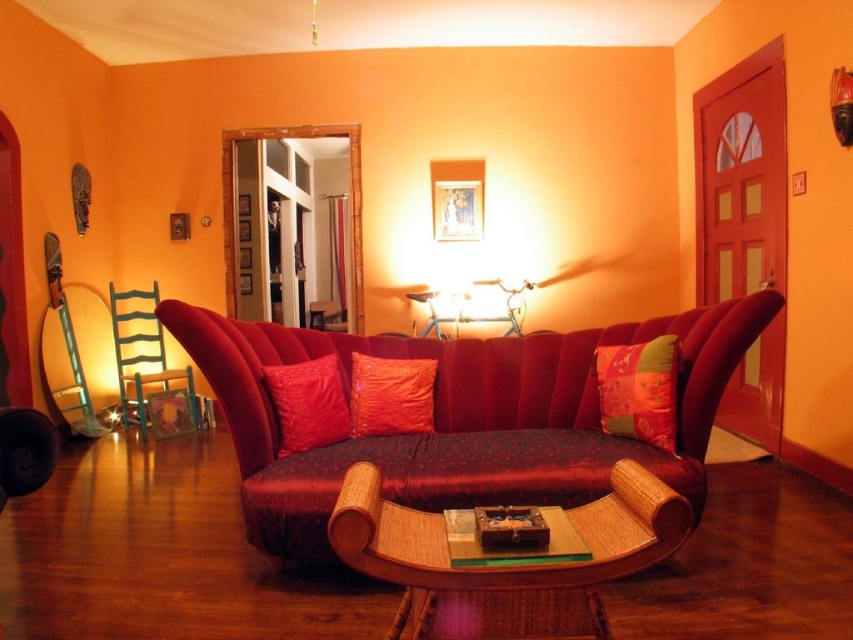
You are arranging a party in the living room and need to place a decorative item on the green painted wood armchair at left and the wooden chest at center. However, you notice that one object is blocking the other. Which one is on top?

The green painted wood armchair at left is positioned over wooden chest at center, so the green painted wood armchair at left is on top of the wooden chest at center.

You are planning to place a large potted plant in the living room. The plant requires a space that can accommodate its 1.2 meter height. Which object between the green painted wood armchair at left and the wooden chest at center is more suitable for placing the plant on top of it?

The green painted wood armchair at left has a larger size compared to wooden chest at center, so it can accommodate the plant with 1.2 meter height better.

You are standing in the living room and want to move from the green painted wood armchair at left to the velvet red couch at center. Which direction should you move to reach the couch?

You should move forward towards the velvet red couch at center because it is closer to you than the green painted wood armchair at left.